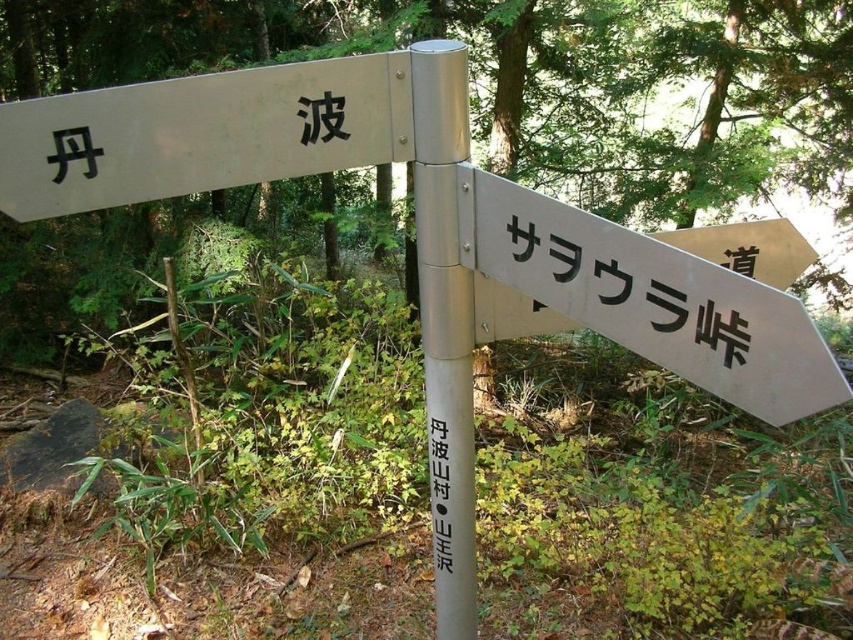
Question: Observing the image, what is the correct spatial positioning of green leafy tree at center in reference to silver metallic sign at center-right?

Choices:
 (A) above
 (B) below

Answer: (A)

Question: Which is nearer to the silver metallic sign at center-right?

Choices:
 (A) silver metallic pole at center
 (B) green leafy tree at center
 (C) white paper sign at center
 (D) white matte signpost at center-right

Answer: (D)

Question: Which of the following is the closest to the observer?

Choices:
 (A) (440, 566)
 (B) (733, 225)
 (C) (437, 188)
 (D) (610, 289)

Answer: (D)

Question: Is green leafy tree at center to the left of white matte signpost at center-right from the viewer's perspective?

Choices:
 (A) yes
 (B) no

Answer: (B)

Question: Estimate the real-world distances between objects in this image. Which object is farther from the white paper sign at center?

Choices:
 (A) green leafy tree at center
 (B) silver metallic sign at center-right
 (C) white matte signpost at center-right

Answer: (A)

Question: Does white matte signpost at center-right have a larger size compared to white paper sign at center?

Choices:
 (A) no
 (B) yes

Answer: (B)